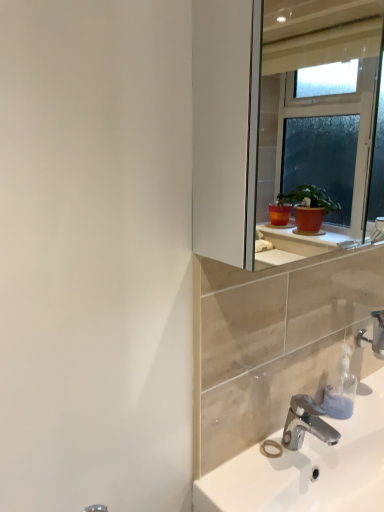
Locate an element on the screen. This screenshot has width=384, height=512. free space in front of translucent plastic soap dispenser at lower right is located at coordinates (340, 442).